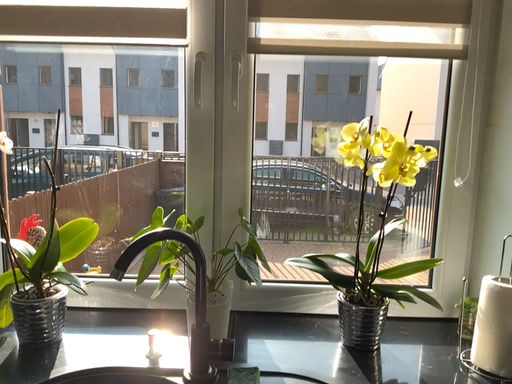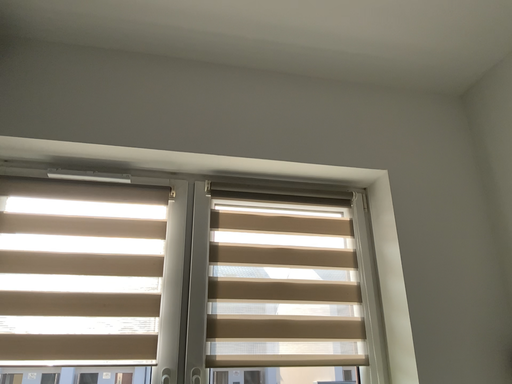
Question: Which way did the camera rotate in the video?

Choices:
 (A) rotated left
 (B) rotated right

Answer: (B)